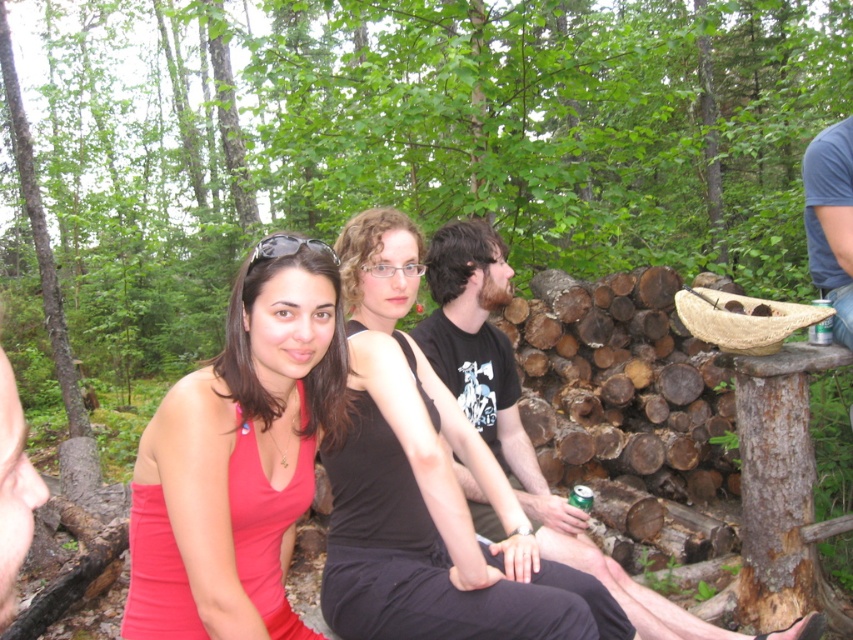
Does point (146, 605) come behind point (381, 554)?

No, (146, 605) is closer to viewer.

Does matte red tank top at center appear on the left side of black matte tank top at center?

Indeed, matte red tank top at center is positioned on the left side of black matte tank top at center.

Is point (151, 586) positioned behind point (404, 632)?

No, it is in front of (404, 632).

Locate an element on the screen. matte red tank top at center is located at coordinates (239, 456).

Consider the image. Who is more distant from viewer, (252,448) or (469,275)?

Point (469,275)

Is matte red tank top at center behind black t-shirt at center?

No, it is not.

Who is more distant from viewer, (252, 440) or (485, 292)?

Positioned behind is point (485, 292).

In order to click on matte red tank top at center in this screenshot , I will do `click(239, 456)`.

I want to click on black matte tank top at center, so click(434, 560).

Does black matte tank top at center have a lesser width compared to black t-shirt at center?

Yes, black matte tank top at center is thinner than black t-shirt at center.

Does point (331, 481) come in front of point (650, 628)?

Yes, it is.

This screenshot has width=853, height=640. In order to click on black matte tank top at center in this screenshot , I will do `click(434, 560)`.